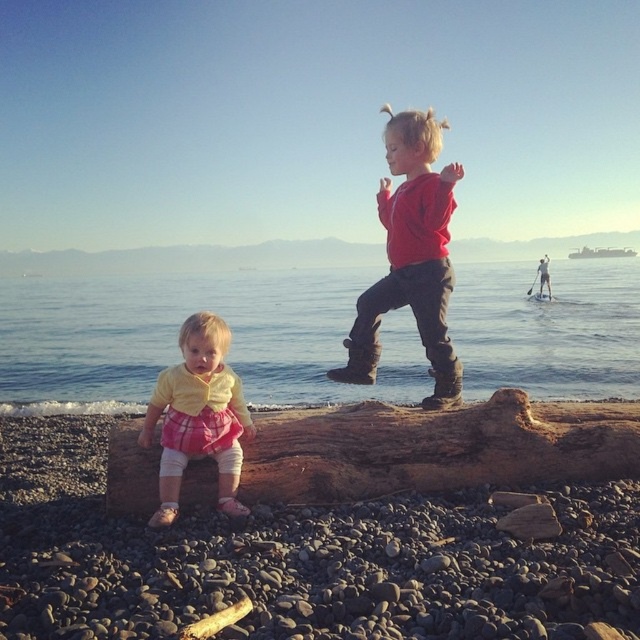
You are standing on the beach and want to place a small flag at the point closest to you between point (3, 572) and point (380, 193). Which point should you choose?

You should choose point (3, 572) because it is closer to the viewer than point (380, 193).

You are a photographer trying to capture both the smooth brown log at center and the yellow cotton shirt at center in the same frame. Based on their sizes, which object should you focus on first to ensure both fit in the shot?

The smooth brown log at center is shorter than the yellow cotton shirt at center, so you should focus on the yellow cotton shirt at center first to ensure both fit in the shot.